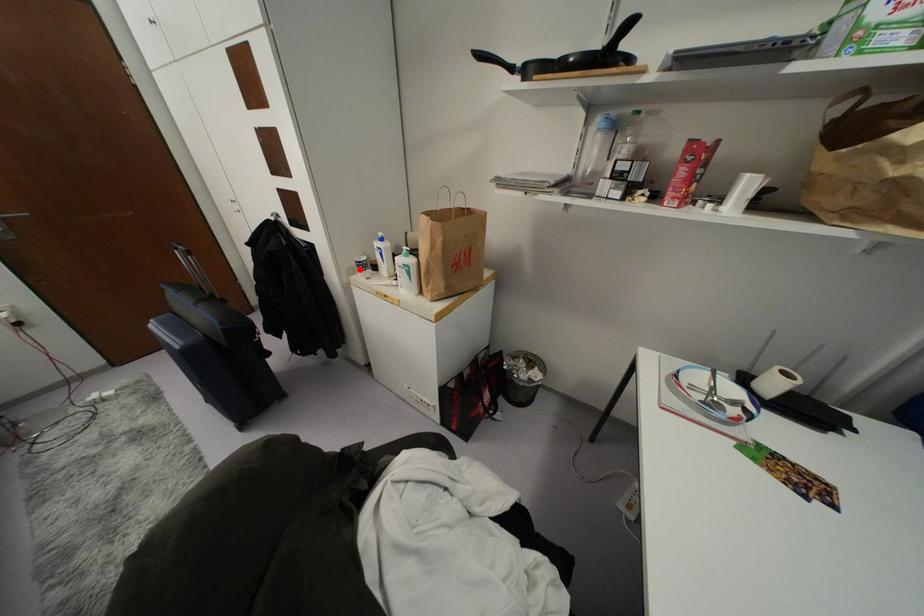
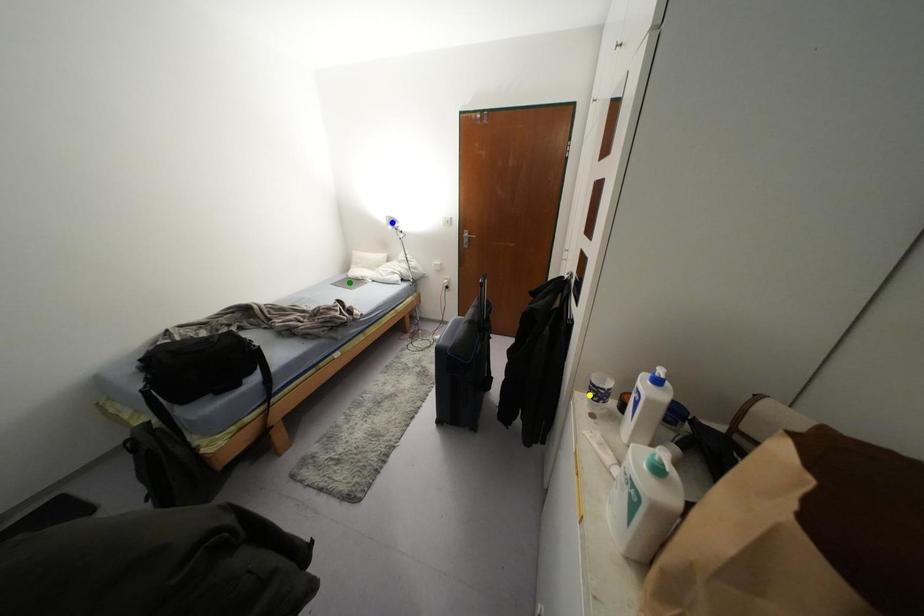
Question: I am providing you with two images of the same scene from different viewpoints. A red point is marked on the first image. You are given multiple points on the second image. Which point in image 2 is actually the same real-world point as the red point in image 1?

Choices:
 (A) blue point
 (B) yellow point
 (C) green point

Answer: (B)